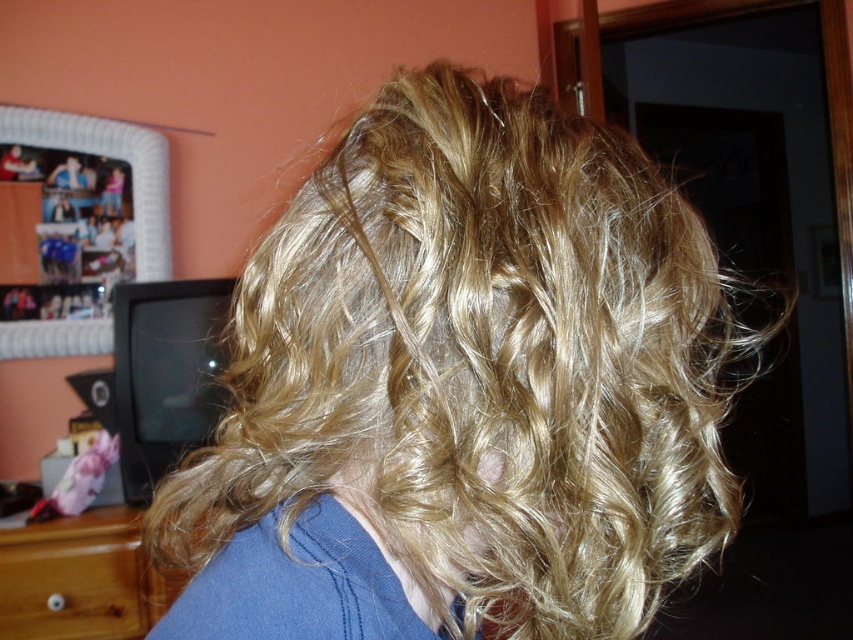
Question: Among these objects, which one is nearest to the camera?

Choices:
 (A) wooden dresser at lower left
 (B) blonde curly hair at center

Answer: (B)

Question: Does blonde curly hair at center appear under wooden dresser at lower left?

Choices:
 (A) yes
 (B) no

Answer: (B)

Question: Which of the following is the closest to the observer?

Choices:
 (A) blonde curly hair at center
 (B) wooden dresser at lower left

Answer: (A)

Question: From the image, what is the correct spatial relationship of blonde curly hair at center in relation to wooden dresser at lower left?

Choices:
 (A) left
 (B) right

Answer: (B)

Question: Can you confirm if blonde curly hair at center is thinner than wooden dresser at lower left?

Choices:
 (A) no
 (B) yes

Answer: (A)